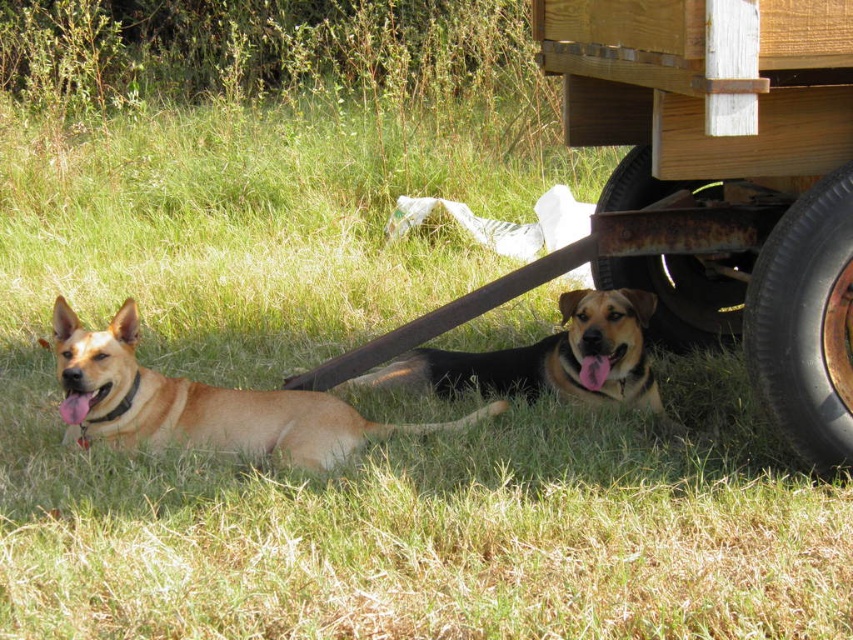
Who is lower down, brown fur dog at lower center or rusty metal tire at lower right?

brown fur dog at lower center

Between point (608, 301) and point (692, 333), which one is positioned behind?

The point (692, 333) is behind.

The image size is (853, 640). What do you see at coordinates (548, 358) in the screenshot?
I see `brown fur dog at lower center` at bounding box center [548, 358].

Identify the location of brown fur dog at lower center. (548, 358).

Is golden fur dog at left further to camera compared to rusty metal tire at lower right?

No, it is not.

Is golden fur dog at left to the right of rusty metal tire at lower right from the viewer's perspective?

No, golden fur dog at left is not to the right of rusty metal tire at lower right.

Which is in front, point (102, 394) or point (721, 268)?

Point (102, 394)

This screenshot has height=640, width=853. Identify the location of golden fur dog at left. (202, 404).

Does black rubber tire at lower right have a lesser width compared to rusty metal tire at lower right?

Indeed, black rubber tire at lower right has a lesser width compared to rusty metal tire at lower right.

Is black rubber tire at lower right shorter than rusty metal tire at lower right?

Incorrect, black rubber tire at lower right's height does not fall short of rusty metal tire at lower right's.

The width and height of the screenshot is (853, 640). Describe the element at coordinates (805, 323) in the screenshot. I see `black rubber tire at lower right` at that location.

Locate an element on the screen. black rubber tire at lower right is located at coordinates (805, 323).